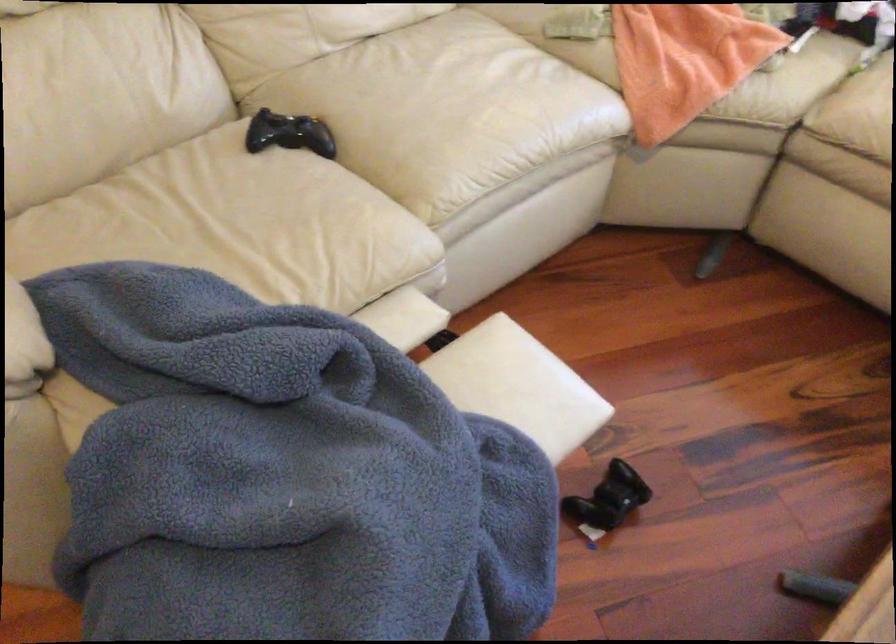
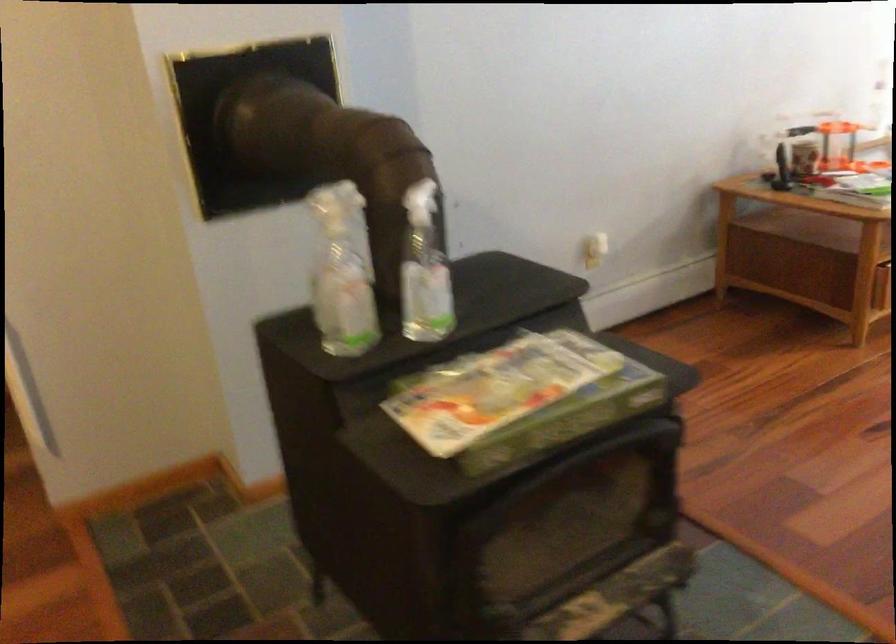
Question: What movement of the cameraman would produce the second image?

Choices:
 (A) Left
 (B) Right
 (C) Forward
 (D) Backward

Answer: (A)